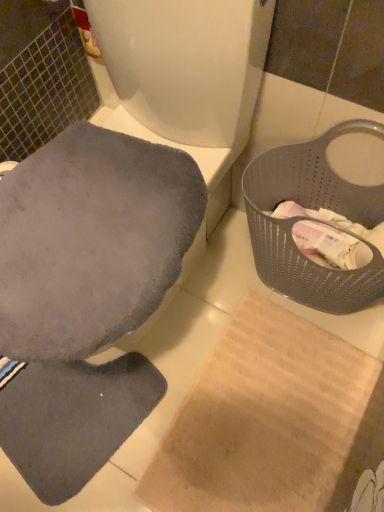
Question: Considering their positions, is gray soft fabric toilet seat at upper left located in front of or behind gray perforated basket at right?

Choices:
 (A) front
 (B) behind

Answer: (A)

Question: From a real-world perspective, relative to gray perforated basket at right, is gray soft fabric toilet seat at upper left vertically above or below?

Choices:
 (A) above
 (B) below

Answer: (A)

Question: Based on their sizes in the image, would you say gray soft fabric toilet seat at upper left is bigger or smaller than gray perforated basket at right?

Choices:
 (A) big
 (B) small

Answer: (A)

Question: In the image, is gray perforated basket at right positioned in front of or behind gray soft fabric toilet seat at upper left?

Choices:
 (A) front
 (B) behind

Answer: (B)

Question: From the image's perspective, is gray perforated basket at right located above or below gray soft fabric toilet seat at upper left?

Choices:
 (A) above
 (B) below

Answer: (B)

Question: From a real-world perspective, is gray perforated basket at right physically located above or below gray soft fabric toilet seat at upper left?

Choices:
 (A) above
 (B) below

Answer: (B)

Question: Is point (331, 130) closer or farther from the camera than point (231, 33)?

Choices:
 (A) farther
 (B) closer

Answer: (A)